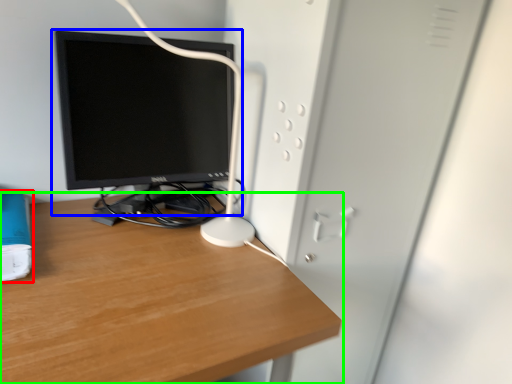
Question: Based on their relative distances, which object is nearer to paperback book (highlighted by a red box)? Choose from computer monitor (highlighted by a blue box) and desk (highlighted by a green box).

Choices:
 (A) computer monitor
 (B) desk

Answer: (B)